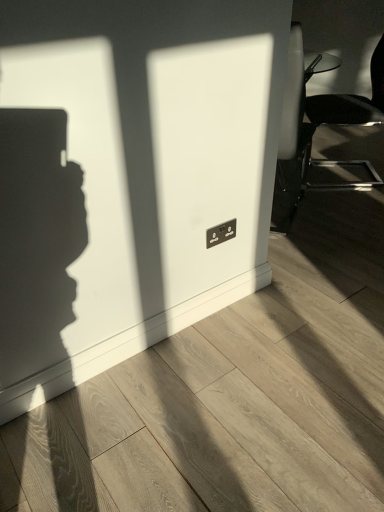
Question: Would you say black plastic electric outlet at center is to the left or to the right of metallic silver chair at right in the picture?

Choices:
 (A) right
 (B) left

Answer: (B)

Question: Is point tap(218, 233) closer or farther from the camera than point tap(350, 98)?

Choices:
 (A) farther
 (B) closer

Answer: (B)

Question: From their relative heights in the image, would you say black plastic electric outlet at center is taller or shorter than metallic silver chair at right?

Choices:
 (A) tall
 (B) short

Answer: (B)

Question: Is metallic silver chair at right bigger or smaller than black plastic electric outlet at center?

Choices:
 (A) big
 (B) small

Answer: (A)

Question: Does point (291, 121) appear closer or farther from the camera than point (213, 237)?

Choices:
 (A) closer
 (B) farther

Answer: (B)

Question: Would you say metallic silver chair at right is to the left or to the right of black plastic electric outlet at center in the picture?

Choices:
 (A) right
 (B) left

Answer: (A)

Question: From the image's perspective, is metallic silver chair at right above or below black plastic electric outlet at center?

Choices:
 (A) below
 (B) above

Answer: (B)